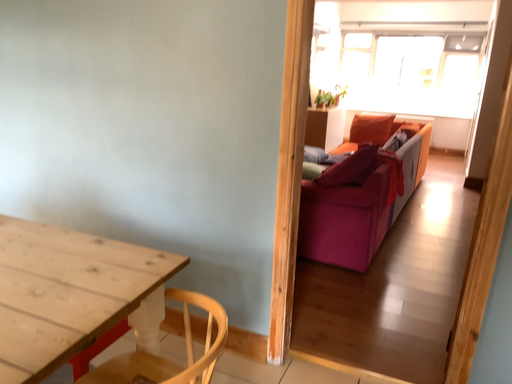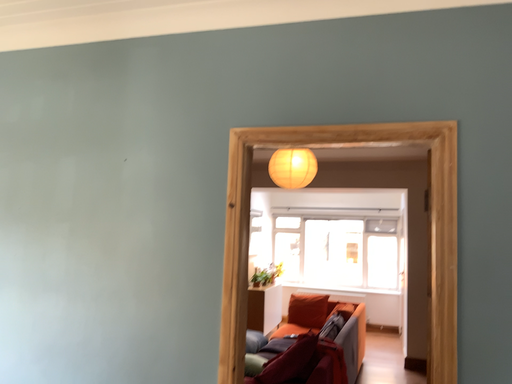
Question: How did the camera likely rotate when shooting the video?

Choices:
 (A) rotated right
 (B) rotated left

Answer: (A)